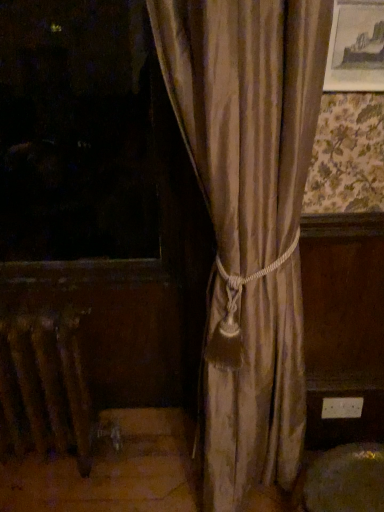
Question: From the image's perspective, relative to metallic radiator at lower left, is wooden picture frame at upper right above or below?

Choices:
 (A) above
 (B) below

Answer: (A)

Question: Considering the positions of wooden picture frame at upper right and metallic radiator at lower left in the image, is wooden picture frame at upper right taller or shorter than metallic radiator at lower left?

Choices:
 (A) tall
 (B) short

Answer: (B)

Question: Looking at the image, does wooden picture frame at upper right seem bigger or smaller compared to metallic radiator at lower left?

Choices:
 (A) big
 (B) small

Answer: (B)

Question: Would you say metallic radiator at lower left is inside or outside wooden picture frame at upper right?

Choices:
 (A) outside
 (B) inside

Answer: (A)

Question: In terms of width, does metallic radiator at lower left look wider or thinner when compared to wooden picture frame at upper right?

Choices:
 (A) wide
 (B) thin

Answer: (A)

Question: From their relative heights in the image, would you say metallic radiator at lower left is taller or shorter than wooden picture frame at upper right?

Choices:
 (A) short
 (B) tall

Answer: (B)

Question: Does point (21, 386) appear closer or farther from the camera than point (370, 75)?

Choices:
 (A) closer
 (B) farther

Answer: (B)